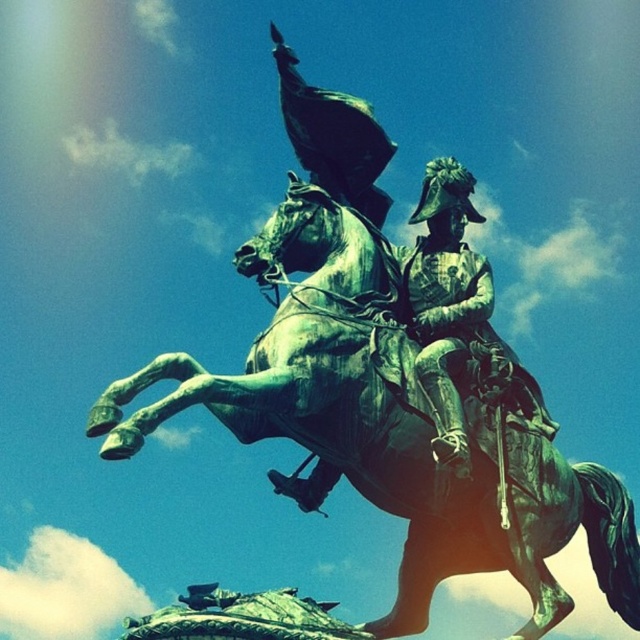
You are a maintenance worker tasked with cleaning the green patinated bronze horse at center and the green patina helmet at center. You have a 20 feet long ladder. Can you reach both objects with the ladder without moving it?

The distance between the green patinated bronze horse at center and the green patina helmet at center is 19.95 feet, which is less than the ladder length of 20 feet. Therefore, the ladder can be positioned to reach both objects without needing to move it.

You are an art conservator examining the bronze equestrian statue. You notice both the green patina helmet at center and the green patinated bronze horse at center. Which object is located to the right of the other?

The green patinated bronze horse at center is positioned on the left side of green patina helmet at center, so the green patina helmet at center is to the right of the green patinated bronze horse at center.